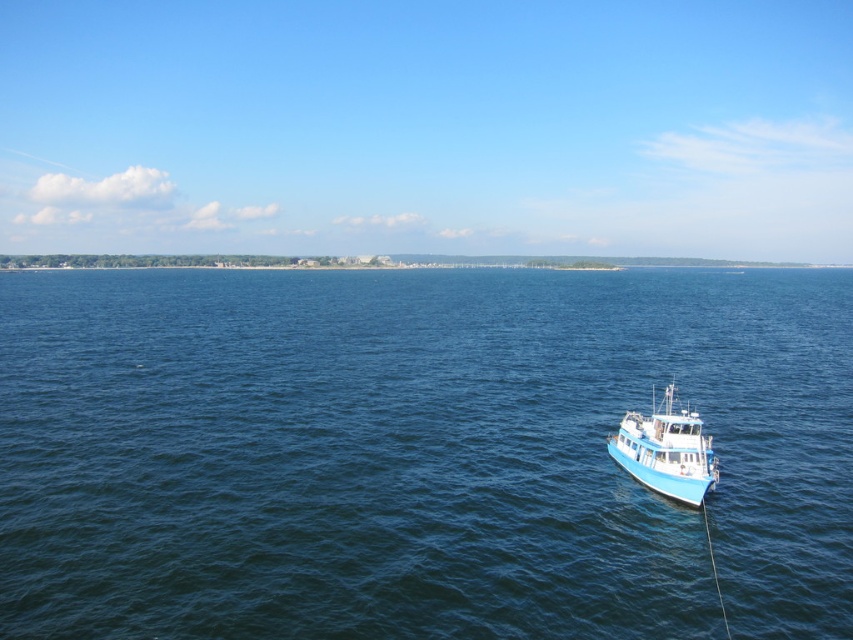
You are standing on the deck of the blue glossy boat at lower right and want to reach the blue water at lower right. Which direction should you move to get there?

The blue water at lower right is to the right of the blue glossy boat at lower right, so you should move to the right to reach it.

You are a sailor trying to navigate your boat to the dock. You see the blue water at lower right and the blue glossy boat at lower right in the image. Which object is positioned higher from the bottom of the image?

The blue water at lower right is located above the blue glossy boat at lower right, so the blue water at lower right is positioned higher from the bottom of the image.

You are a sailor navigating a ship and you see a point marked at coordinates point (x=416, y=452) in the image. Based on the scene, can you determine if this point is located on the boat or in the water?

The point (x=416, y=452) is on blue water at lower right, so it is located in the water and not on the boat.